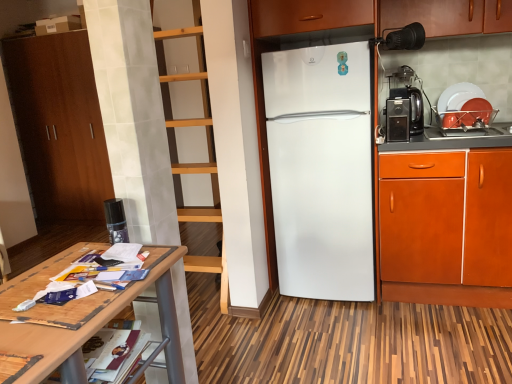
You are a GUI agent. You are given a task and a screenshot of the screen. Output one action in this format:
    pyautogui.click(x=<x>, y=<y>)
    Task: Click on the free spot in front of white matte refrigerator at center
    
    Given the screenshot: What is the action you would take?
    pyautogui.click(x=316, y=328)